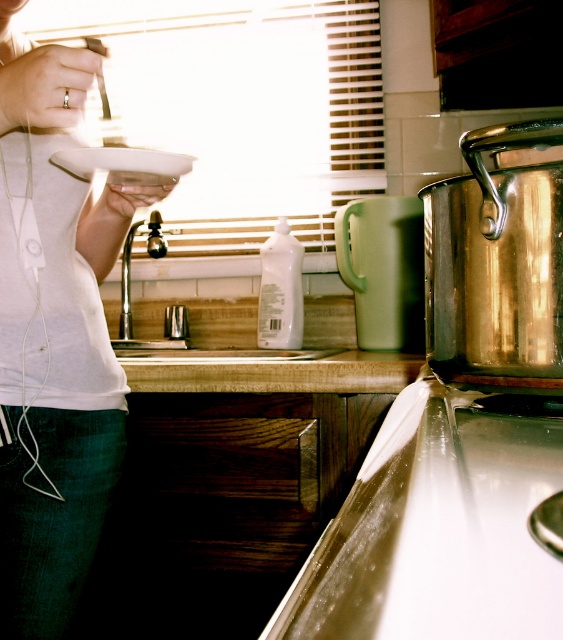
Question: Which point is closer to the camera?

Choices:
 (A) (69, 241)
 (B) (225, 323)

Answer: (A)

Question: Is white matte shirt at upper left below white glossy sink at center?

Choices:
 (A) yes
 (B) no

Answer: (A)

Question: Which of the following is the farthest from the observer?

Choices:
 (A) white glossy sink at center
 (B) white matte shirt at upper left

Answer: (A)

Question: Does white matte shirt at upper left appear on the right side of white glossy sink at center?

Choices:
 (A) yes
 (B) no

Answer: (B)

Question: Does white matte shirt at upper left appear on the right side of white glossy sink at center?

Choices:
 (A) yes
 (B) no

Answer: (B)

Question: Which point is closer to the camera taking this photo?

Choices:
 (A) (69, 416)
 (B) (199, 326)

Answer: (A)